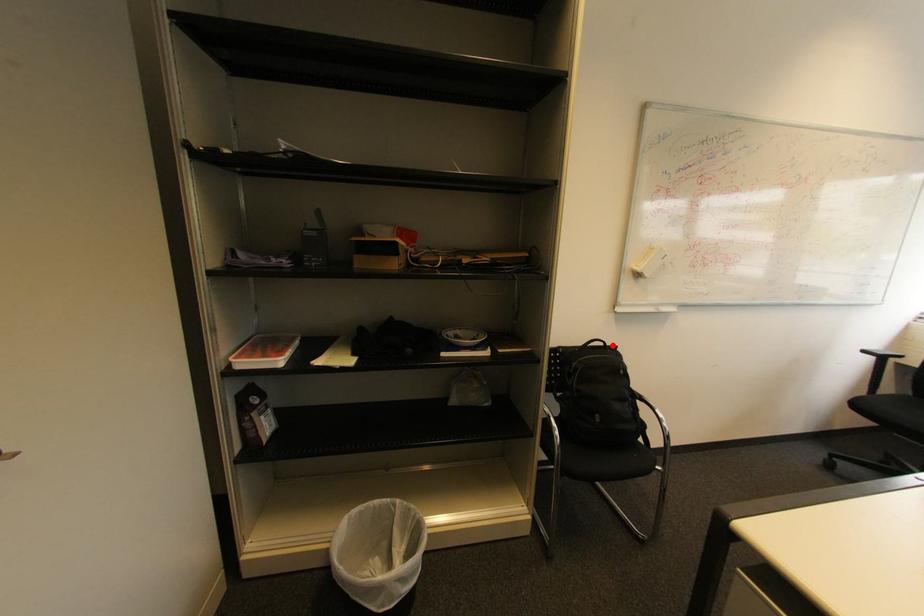
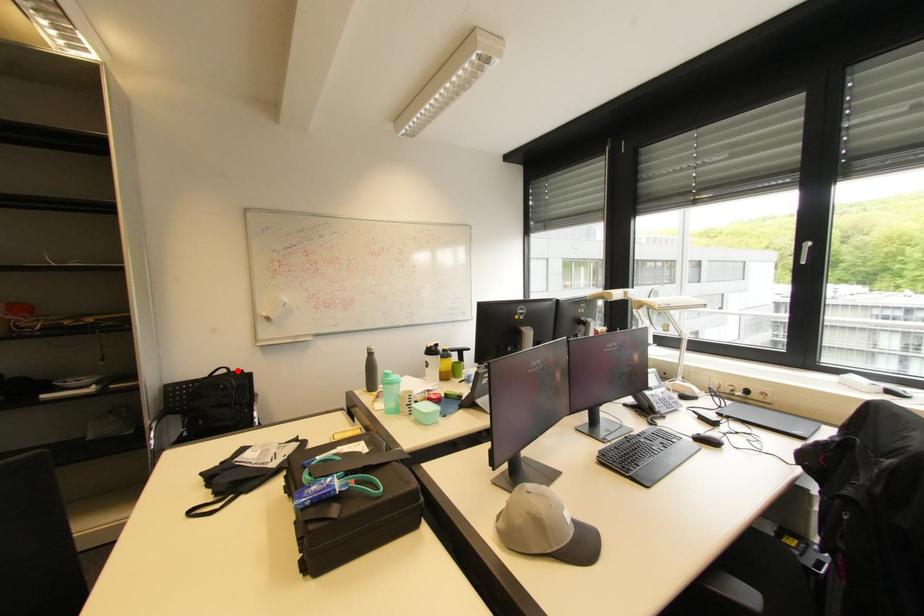
I am providing you with two images of the same scene from different viewpoints. A red point is marked on the first image and another point is marked on the second image. Do the highlighted points in image1 and image2 indicate the same real-world spot?

Yes